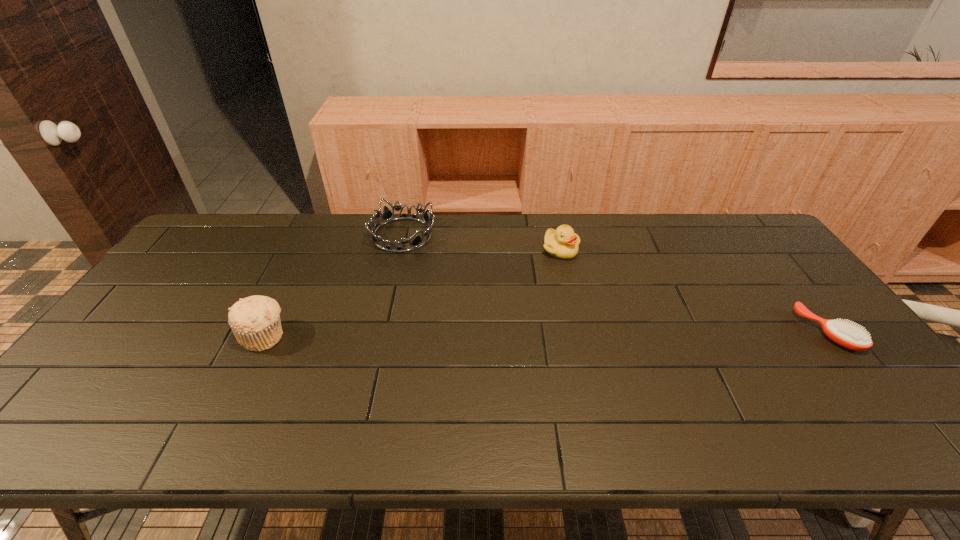
Locate an element on the screen. The width and height of the screenshot is (960, 540). vacant space at the right edge of the desktop is located at coordinates (732, 255).

In the image, there is a desktop. Identify the location of free space at the far left corner. Image resolution: width=960 pixels, height=540 pixels. (180, 254).

At what (x,y) coordinates should I click in order to perform the action: click on vacant space at the far right corner of the desktop. Please return your answer as a coordinate pair (x, y). Looking at the image, I should click on (757, 232).

In the image, there is a desktop. Where is `vacant space at the near right corner`? vacant space at the near right corner is located at coordinates (847, 387).

The image size is (960, 540). I want to click on free area in between the tiara and the third object from left to right, so click(482, 242).

The image size is (960, 540). What are the coordinates of `empty space between the third object from right to left and the muffin` in the screenshot? It's located at (333, 285).

At what (x,y) coordinates should I click in order to perform the action: click on free point between the rightmost object and the tiara. Please return your answer as a coordinate pair (x, y). Looking at the image, I should click on (614, 284).

Image resolution: width=960 pixels, height=540 pixels. In order to click on free spot between the muffin and the third object from right to left in this screenshot , I will do `click(333, 285)`.

At what (x,y) coordinates should I click in order to perform the action: click on free space between the tallest object and the duckling. Please return your answer as a coordinate pair (x, y). The image size is (960, 540). Looking at the image, I should click on (413, 293).

Where is `vacant space that's between the tiara and the duckling`? vacant space that's between the tiara and the duckling is located at coordinates click(x=482, y=242).